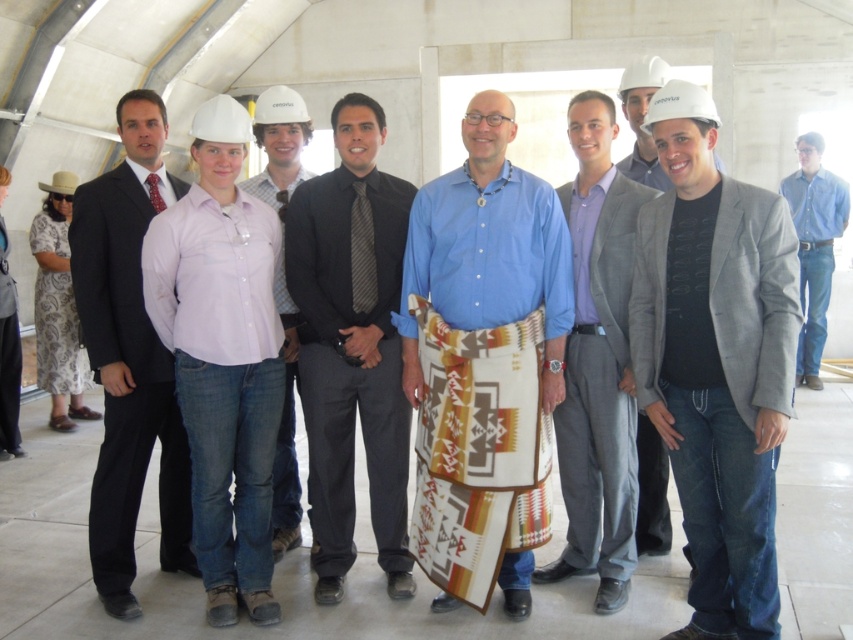
Question: Which is farther from the matte black suit at left?

Choices:
 (A) black smooth shirt at center
 (B) gray fabric at center
 (C) blue denim jeans at right

Answer: (C)

Question: Can you confirm if gray matte blazer at center is positioned to the left of white matte hard hat at center?

Choices:
 (A) yes
 (B) no

Answer: (B)

Question: Does gray matte blazer at center come in front of blue denim jeans at right?

Choices:
 (A) no
 (B) yes

Answer: (B)

Question: Which point is closer to the camera taking this photo?

Choices:
 (A) (381, 109)
 (B) (554, 314)

Answer: (B)

Question: Does white matte hard hat at center have a larger size compared to gray wool suit at center?

Choices:
 (A) yes
 (B) no

Answer: (A)

Question: Which point appears closest to the camera in this image?

Choices:
 (A) (807, 132)
 (B) (128, 180)

Answer: (B)